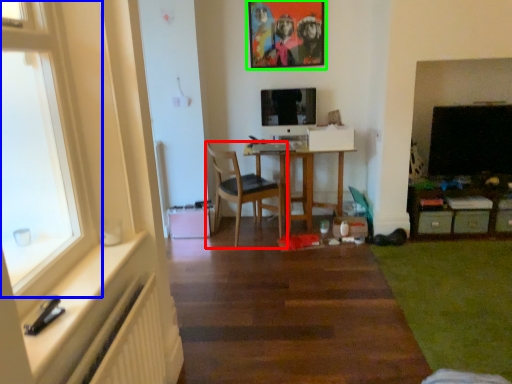
Question: Considering the real-world distances, which object is farthest from chair (highlighted by a red box)? window (highlighted by a blue box) or picture frame (highlighted by a green box)?

Choices:
 (A) window
 (B) picture frame

Answer: (A)